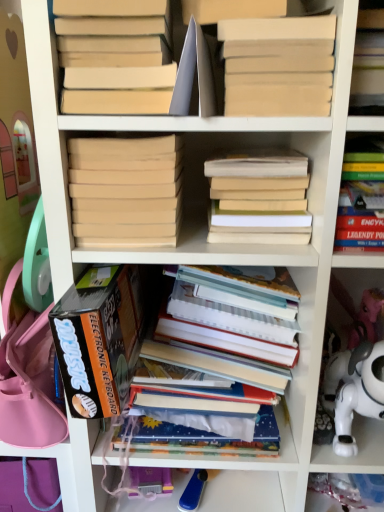
Question: Can you confirm if white plastic toy at lower right is thinner than black cardboard box at lower left, which is the 7th book in right-to-left order?

Choices:
 (A) no
 (B) yes

Answer: (B)

Question: Can you confirm if white plastic toy at lower right is bigger than black cardboard box at lower left, placed as the 1th book when sorted from left to right?

Choices:
 (A) yes
 (B) no

Answer: (A)

Question: Is white plastic toy at lower right aimed at black cardboard box at lower left, which is the 7th book in right-to-left order?

Choices:
 (A) no
 (B) yes

Answer: (A)

Question: Is white plastic toy at lower right directly adjacent to black cardboard box at lower left, placed as the 1th book when sorted from left to right?

Choices:
 (A) yes
 (B) no

Answer: (B)

Question: From a real-world perspective, is white plastic toy at lower right located higher than black cardboard box at lower left, placed as the 1th book when sorted from left to right?

Choices:
 (A) no
 (B) yes

Answer: (A)

Question: Is beige matte book at center, which is the second book from left to right, bigger or smaller than matte beige book at upper left, placed as the 3th book when sorted from left to right?

Choices:
 (A) small
 (B) big

Answer: (A)

Question: Visually, is beige matte book at center, which is the second book from left to right, positioned to the left or to the right of matte beige book at upper left, placed as the 3th book when sorted from left to right?

Choices:
 (A) left
 (B) right

Answer: (A)

Question: Which is correct: beige matte book at center, which is the second book from left to right, is inside matte beige book at upper left, placed as the 3th book when sorted from left to right, or outside of it?

Choices:
 (A) inside
 (B) outside

Answer: (B)

Question: Does point (137, 161) appear closer or farther from the camera than point (97, 51)?

Choices:
 (A) closer
 (B) farther

Answer: (B)

Question: Is point (220, 195) positioned closer to the camera than point (235, 25)?

Choices:
 (A) closer
 (B) farther

Answer: (B)

Question: Is light brown matte book at center, placed as the 2th book when sorted from right to left, to the left or to the right of beige cardboard book at upper center, which appears as the third book when viewed from the right, in the image?

Choices:
 (A) left
 (B) right

Answer: (B)

Question: In terms of width, does light brown matte book at center, placed as the 2th book when sorted from right to left, look wider or thinner when compared to beige cardboard book at upper center, which appears as the third book when viewed from the right?

Choices:
 (A) wide
 (B) thin

Answer: (A)

Question: In the image, is light brown matte book at center, which is the 6th book from left to right, positioned in front of or behind beige cardboard book at upper center, which is counted as the fifth book, starting from the left?

Choices:
 (A) front
 (B) behind

Answer: (B)

Question: From the image's perspective, relative to white plastic toy at lower right, is hardcover books at center, which is counted as the fourth book, starting from the right, above or below?

Choices:
 (A) above
 (B) below

Answer: (A)

Question: Considering the positions of hardcover books at center, which is counted as the fourth book, starting from the right, and white plastic toy at lower right in the image, is hardcover books at center, which is counted as the fourth book, starting from the right, taller or shorter than white plastic toy at lower right?

Choices:
 (A) tall
 (B) short

Answer: (A)